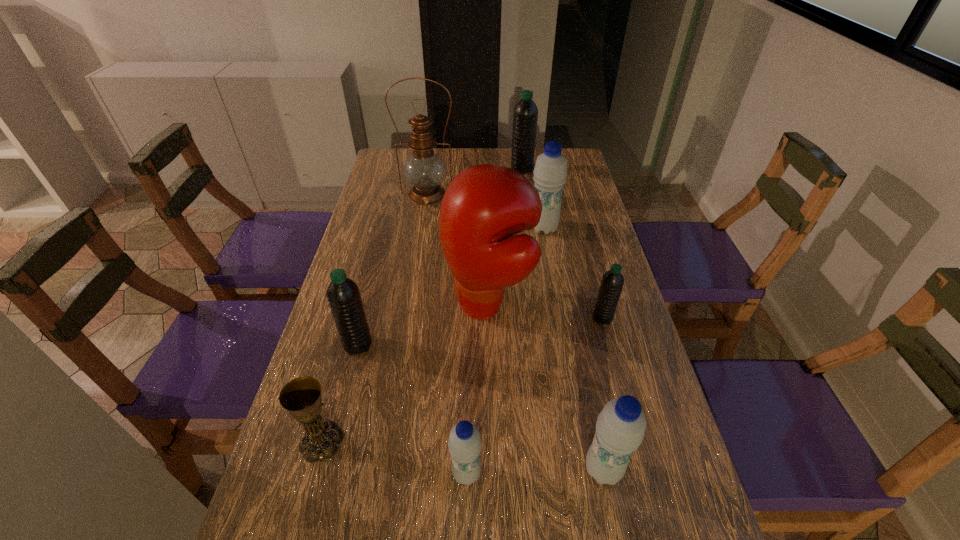
Find the location of a particular element. The image size is (960, 540). free space in the image that satisfies the following two spatial constraints: 1. on the front side of the smallest black water bottle; 2. on the right side of the oil lamp is located at coordinates (407, 318).

This screenshot has width=960, height=540. I want to click on vacant area that satisfies the following two spatial constraints: 1. on the front side of the second biggest blue water bottle; 2. on the left side of the leftmost water bottle, so click(x=326, y=469).